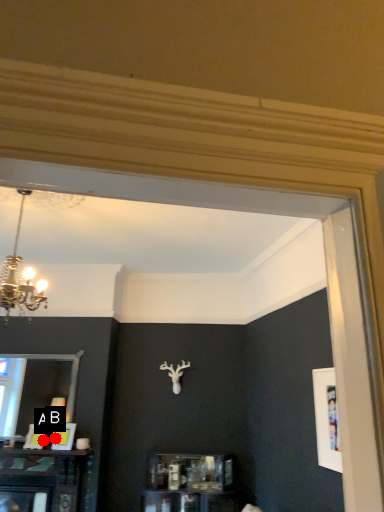
Question: Two points are circled on the image, labeled by A and B beside each circle. Among these points, which one is farthest from the camera?

Choices:
 (A) A is further
 (B) B is further

Answer: (B)